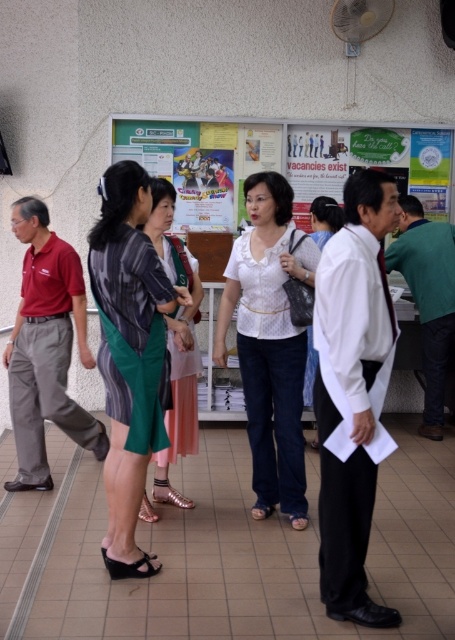
Question: In this image, where is striped fabric dress at center located relative to white lace blouse at center?

Choices:
 (A) above
 (B) below

Answer: (B)

Question: Considering the real-world distances, which object is farthest from the matte striped shirt at center?

Choices:
 (A) striped fabric dress at center
 (B) white lace blouse at center

Answer: (A)

Question: Observing the image, what is the correct spatial positioning of matte striped shirt at center in reference to white textured blouse at center?

Choices:
 (A) right
 (B) left

Answer: (B)

Question: Which point is closer to the camera?

Choices:
 (A) (296, 490)
 (B) (148, 177)

Answer: (B)

Question: Which object appears farthest from the camera in this image?

Choices:
 (A) matte striped shirt at center
 (B) striped fabric dress at center
 (C) white textured blouse at center
 (D) white lace blouse at center

Answer: (C)

Question: Is white lace blouse at center to the left of matte striped shirt at center from the viewer's perspective?

Choices:
 (A) yes
 (B) no

Answer: (B)